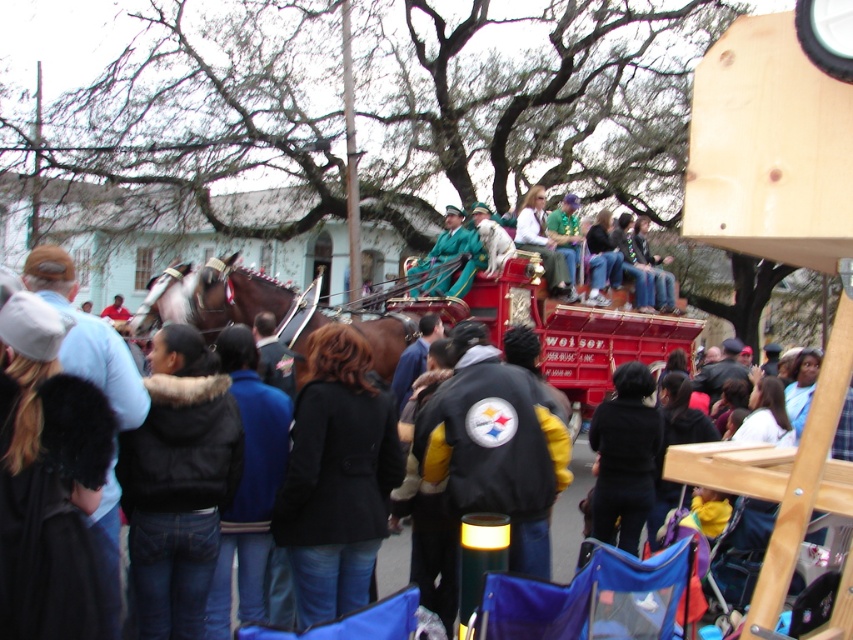
Can you confirm if black fuzzy vest at center is positioned below shiny brown horse at left?

Correct, black fuzzy vest at center is located below shiny brown horse at left.

Is point (204, 566) farther from camera compared to point (140, 326)?

No, it is in front of (140, 326).

Where is `black fuzzy vest at center`? The height and width of the screenshot is (640, 853). black fuzzy vest at center is located at coordinates (178, 483).

Who is positioned more to the left, black fuzzy vest at center or black wool coat at center?

black fuzzy vest at center

Can you confirm if black fuzzy vest at center is taller than black wool coat at center?

In fact, black fuzzy vest at center may be shorter than black wool coat at center.

Which is in front, point (210, 468) or point (300, 560)?

Point (210, 468) is in front.

The height and width of the screenshot is (640, 853). What are the coordinates of `black fuzzy vest at center` in the screenshot? It's located at (178, 483).

Can you confirm if green velvet jacket at center is positioned to the right of shiny brown horse at left?

Yes, green velvet jacket at center is to the right of shiny brown horse at left.

Is point (482, 212) closer to camera compared to point (146, 332)?

No.

Which is behind, point (554, 237) or point (169, 268)?

Positioned behind is point (554, 237).

The height and width of the screenshot is (640, 853). Identify the location of green velvet jacket at center. (548, 250).